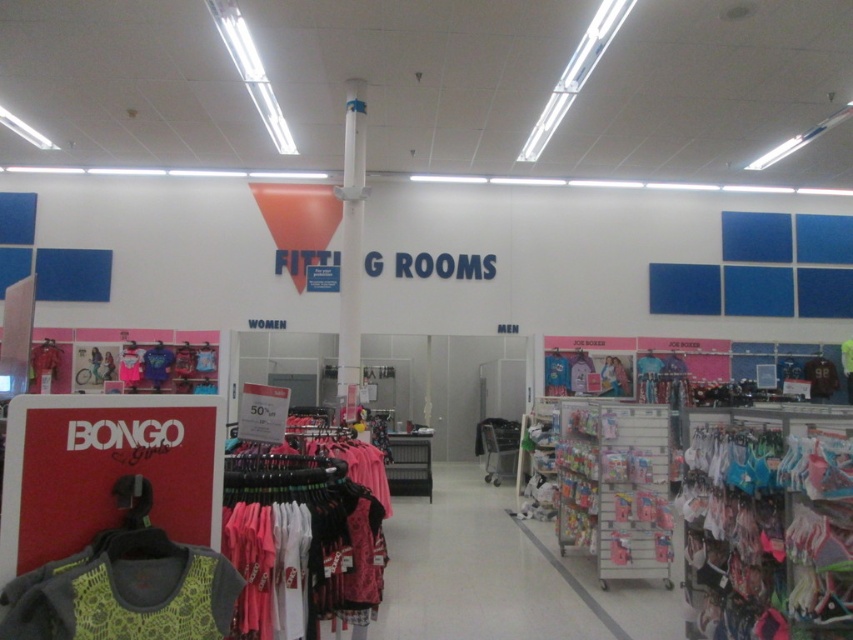
Is pink fabric at center taller than lime green mesh tank top at lower left?

No.

Does pink fabric at center have a larger size compared to lime green mesh tank top at lower left?

Actually, pink fabric at center might be smaller than lime green mesh tank top at lower left.

Between point (433, 499) and point (151, 609), which one is positioned behind?

Positioned behind is point (433, 499).

This screenshot has height=640, width=853. Find the location of `pink fabric at center`. pink fabric at center is located at coordinates (485, 572).